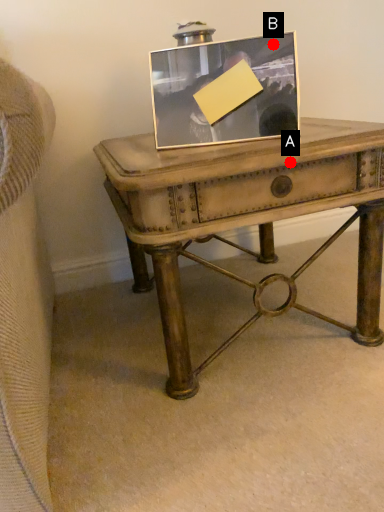
Question: Two points are circled on the image, labeled by A and B beside each circle. Which point is closer to the camera?

Choices:
 (A) A is closer
 (B) B is closer

Answer: (A)